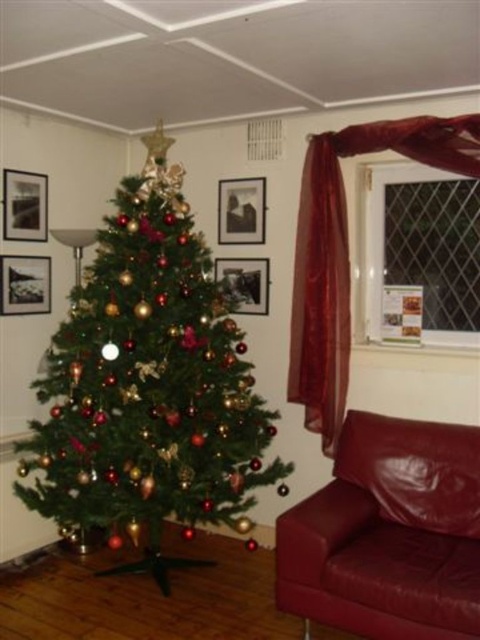
Question: Which point appears closest to the camera in this image?

Choices:
 (A) (444, 460)
 (B) (252, 292)
 (C) (346, 211)
 (D) (6, 256)

Answer: (A)

Question: Which object appears farthest from the camera in this image?

Choices:
 (A) satin red curtain at right
 (B) leather couch at lower right
 (C) black matte picture frame at upper left

Answer: (C)

Question: Is black matte picture frame at upper left to the right of metallic silver photo frame at center from the viewer's perspective?

Choices:
 (A) no
 (B) yes

Answer: (A)

Question: Can you confirm if black matte picture frame at upper left is positioned below metallic silver photo frame at center?

Choices:
 (A) no
 (B) yes

Answer: (A)

Question: Which object is the closest to the satin red curtain at right?

Choices:
 (A) black matte picture frame at upper center
 (B) black matte picture frame at upper left
 (C) black matte picture frame at left
 (D) metallic silver photo frame at center

Answer: (D)

Question: Can you confirm if green matte christmas tree at center is positioned to the right of satin red curtain at right?

Choices:
 (A) no
 (B) yes

Answer: (A)